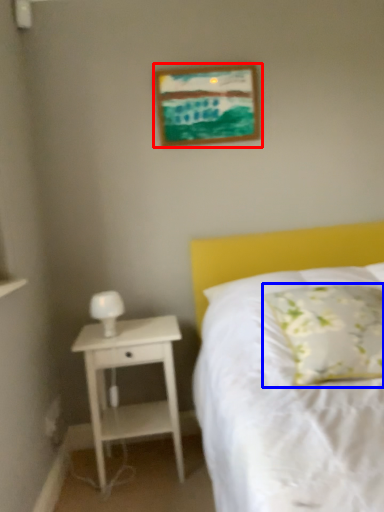
Question: Among these objects, which one is farthest to the camera, picture frame (highlighted by a red box) or pillow (highlighted by a blue box)?

Choices:
 (A) picture frame
 (B) pillow

Answer: (A)